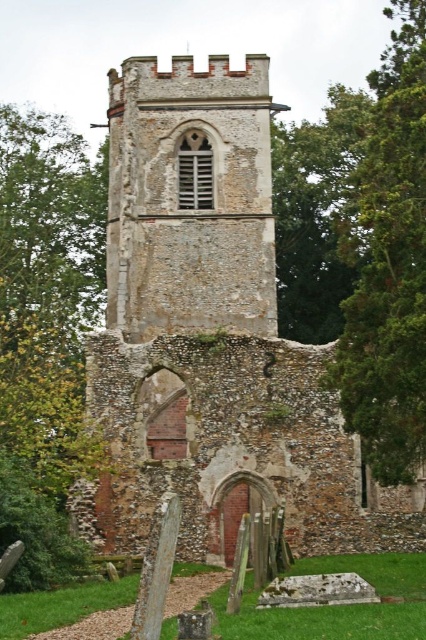
The width and height of the screenshot is (426, 640). Describe the element at coordinates (46, 337) in the screenshot. I see `green leafy tree at left` at that location.

Is green leafy tree at left to the right of green coniferous tree at right from the viewer's perspective?

No, green leafy tree at left is not to the right of green coniferous tree at right.

This screenshot has height=640, width=426. I want to click on green leafy tree at left, so click(x=46, y=337).

This screenshot has width=426, height=640. Identify the location of green leafy tree at left. (46, 337).

What are the coordinates of `brown stone church at center` in the screenshot? It's located at (212, 337).

Is point (144, 186) positioned behind point (377, 310)?

Yes, it is behind point (377, 310).

Is point (92, 500) farther from camera compared to point (331, 376)?

Yes, point (92, 500) is farther from viewer.

You are a GUI agent. You are given a task and a screenshot of the screen. Output one action in this format:
    pyautogui.click(x=<x>, y=<y>)
    Task: Click on the brown stone church at center
    This screenshot has width=426, height=640.
    Given the screenshot: What is the action you would take?
    pyautogui.click(x=212, y=337)

Is brown stone church at center to the right of green leafy tree at left from the viewer's perspective?

Correct, you'll find brown stone church at center to the right of green leafy tree at left.

Describe the element at coordinates (212, 337) in the screenshot. I see `brown stone church at center` at that location.

Where is `brown stone church at center`? The width and height of the screenshot is (426, 640). brown stone church at center is located at coordinates coord(212,337).